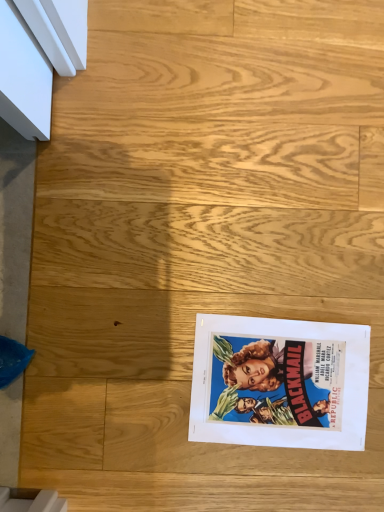
You are a GUI agent. You are given a task and a screenshot of the screen. Output one action in this format:
    pyautogui.click(x=<x>, y=<y>)
    Task: Click on the vacant area on top of matte paper movie poster at lower right (from a real-world perspective)
    The height and width of the screenshot is (512, 384).
    Given the screenshot: What is the action you would take?
    pyautogui.click(x=282, y=382)